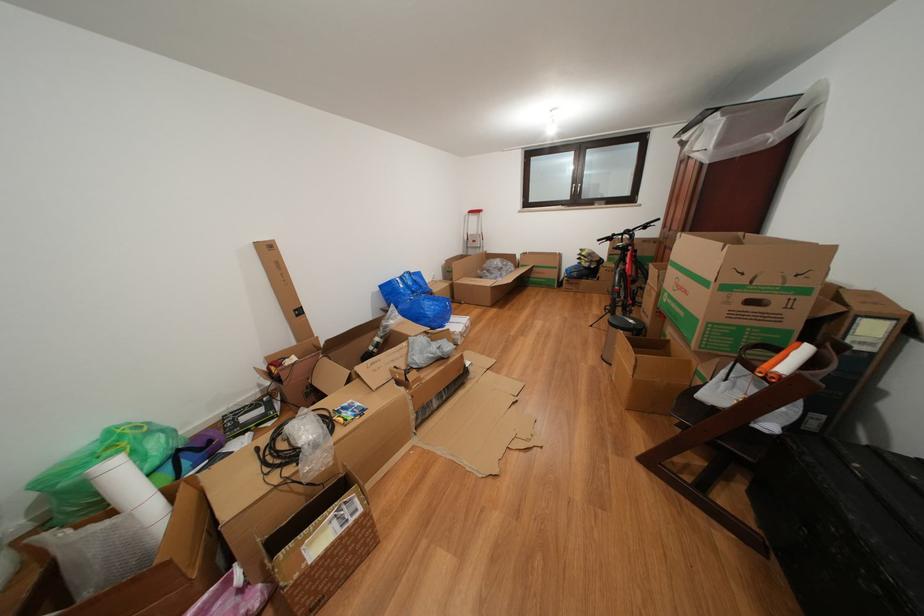
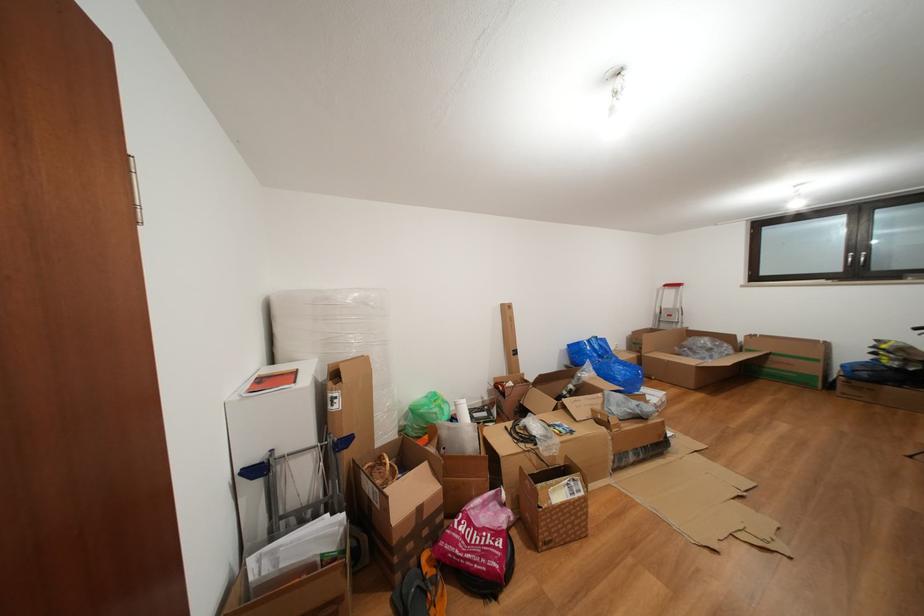
Find the pixel in the second image that matches point 589,283 in the first image.

(886, 387)